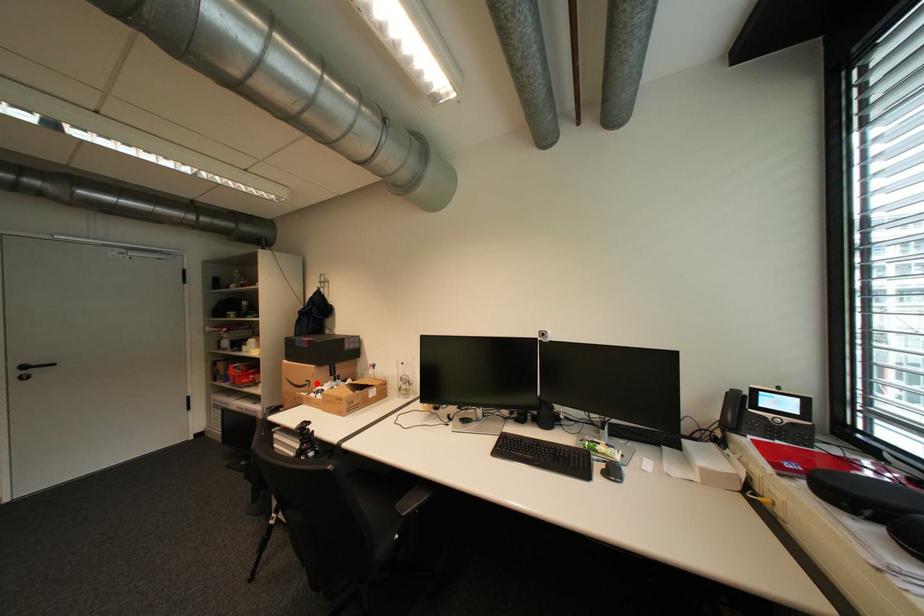
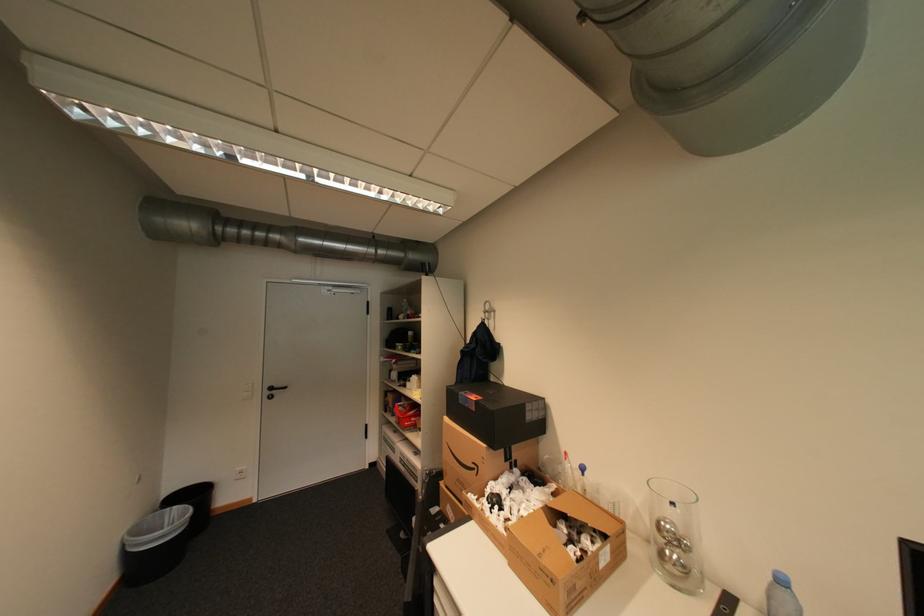
Question: A red point is marked in image1. In image2, is the corresponding 3D point closer to the camera or farther? Reply with the corresponding letter.

Choices:
 (A) The corresponding 3D point is closer.
 (B) The corresponding 3D point is farther.

Answer: (B)